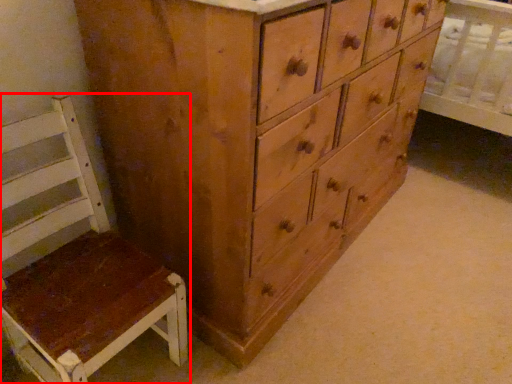
Question: In this image, where is furniture (annotated by the red box) located relative to chest of drawers?

Choices:
 (A) left
 (B) right

Answer: (A)